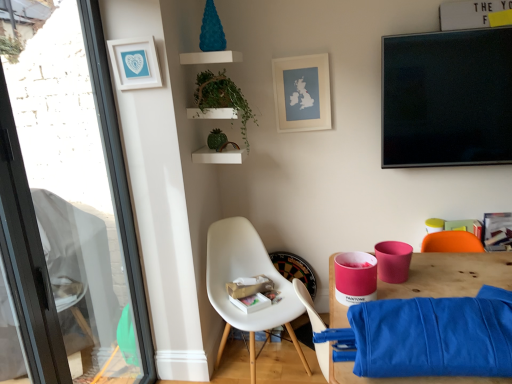
Question: Are green matte plant at upper center and white matte picture frame at upper left, the second picture frame from the back, making contact?

Choices:
 (A) yes
 (B) no

Answer: (B)

Question: Would you consider green matte plant at upper center to be distant from white matte picture frame at upper left, which is the 1th picture frame from left to right?

Choices:
 (A) no
 (B) yes

Answer: (A)

Question: Is green matte plant at upper center taller than white matte picture frame at upper left, the second picture frame in the right-to-left sequence?

Choices:
 (A) no
 (B) yes

Answer: (B)

Question: Can you confirm if green matte plant at upper center is wider than white matte picture frame at upper left, which is the 1th picture frame from left to right?

Choices:
 (A) no
 (B) yes

Answer: (B)

Question: Can you confirm if green matte plant at upper center is thinner than white matte picture frame at upper left, the first picture frame viewed from the front?

Choices:
 (A) no
 (B) yes

Answer: (A)

Question: From the image's perspective, does green matte plant at upper center appear lower than white matte picture frame at upper left, which is the 1th picture frame from left to right?

Choices:
 (A) yes
 (B) no

Answer: (A)

Question: Is the surface of white plastic chair at lower center in direct contact with blue fabric at lower right?

Choices:
 (A) no
 (B) yes

Answer: (A)

Question: Does white plastic chair at lower center lie behind blue fabric at lower right?

Choices:
 (A) yes
 (B) no

Answer: (A)

Question: From the image's perspective, is white plastic chair at lower center beneath blue fabric at lower right?

Choices:
 (A) no
 (B) yes

Answer: (A)

Question: Can you confirm if white plastic chair at lower center is wider than blue fabric at lower right?

Choices:
 (A) yes
 (B) no

Answer: (B)

Question: Is white plastic chair at lower center outside of blue fabric at lower right?

Choices:
 (A) no
 (B) yes

Answer: (B)

Question: Is the depth of white plastic chair at lower center less than that of blue fabric at lower right?

Choices:
 (A) yes
 (B) no

Answer: (B)

Question: Is green matte plant at upper center outside matte white picture frame at upper center, the 2th picture frame from the front?

Choices:
 (A) no
 (B) yes

Answer: (B)